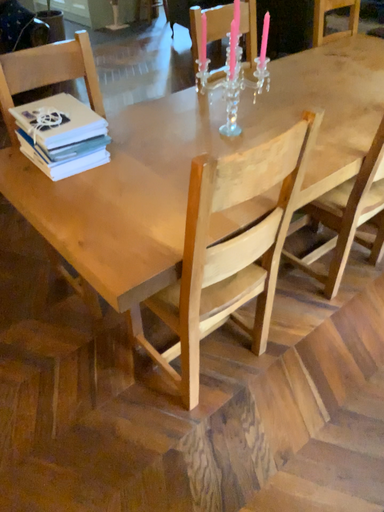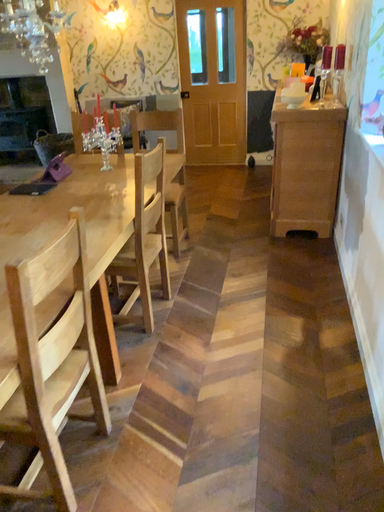
Question: Which way did the camera rotate in the video?

Choices:
 (A) rotated right
 (B) rotated left

Answer: (A)